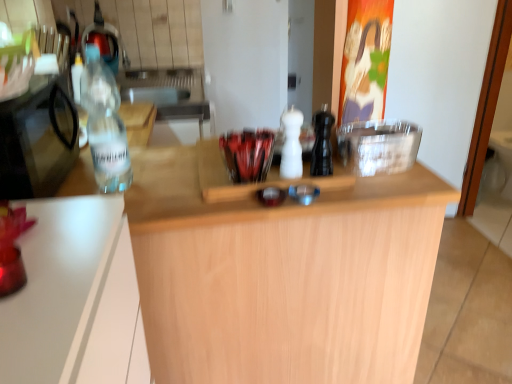
At what (x,y) coordinates should I click in order to perform the action: click on free space to the right of transparent plastic bottle at left, the first appliance from the left. Please return your answer as a coordinate pair (x, y). The image size is (512, 384). Looking at the image, I should click on (163, 175).